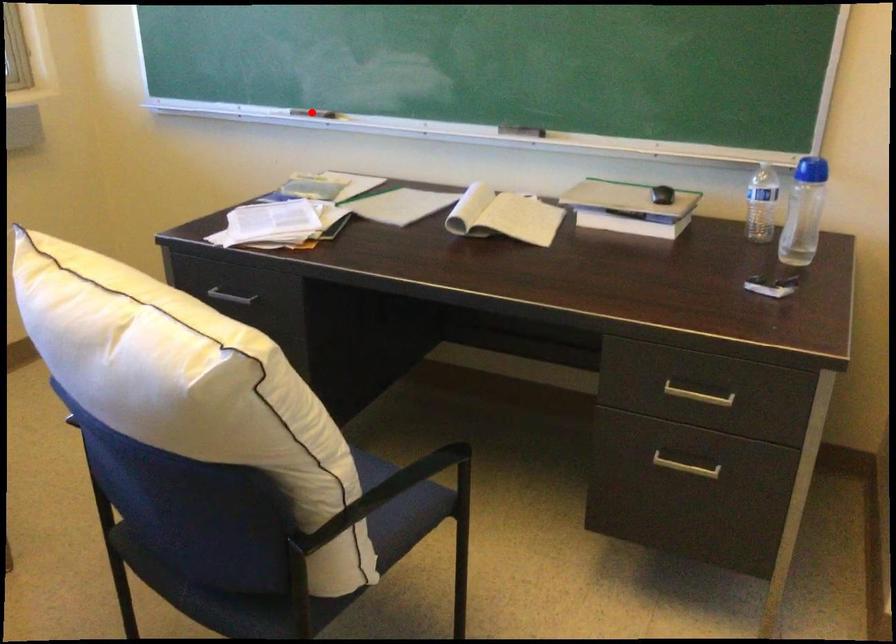
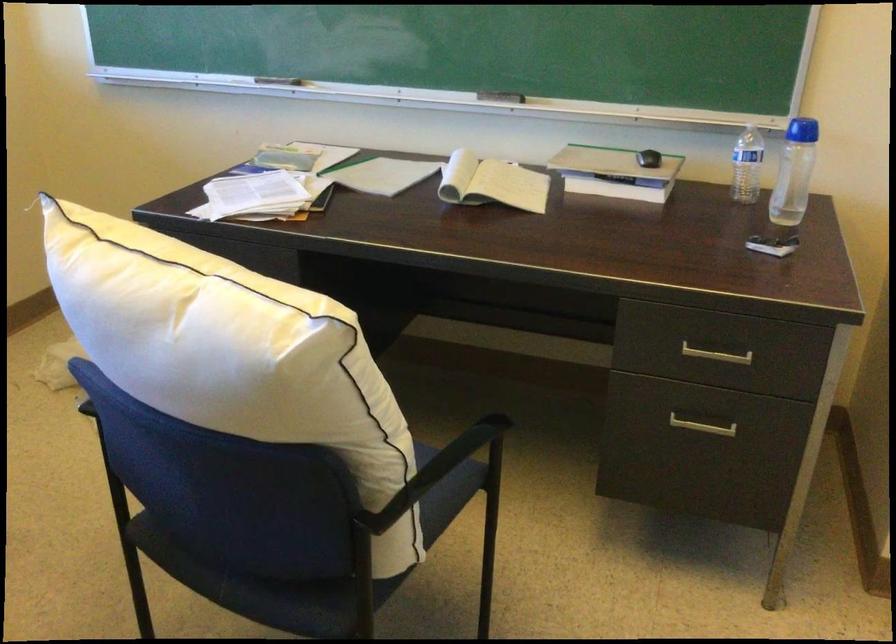
Find the pixel in the second image that matches the highlighted location in the first image.

(279, 80)